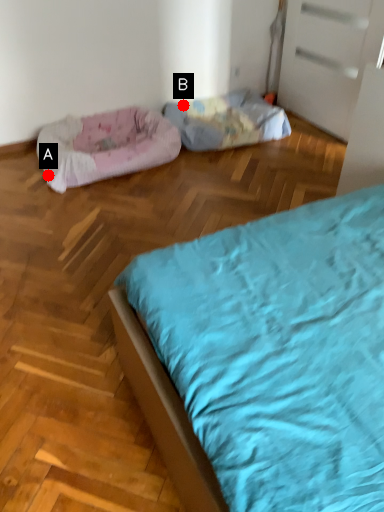
Question: Two points are circled on the image, labeled by A and B beside each circle. Which point is further to the camera?

Choices:
 (A) A is further
 (B) B is further

Answer: (B)